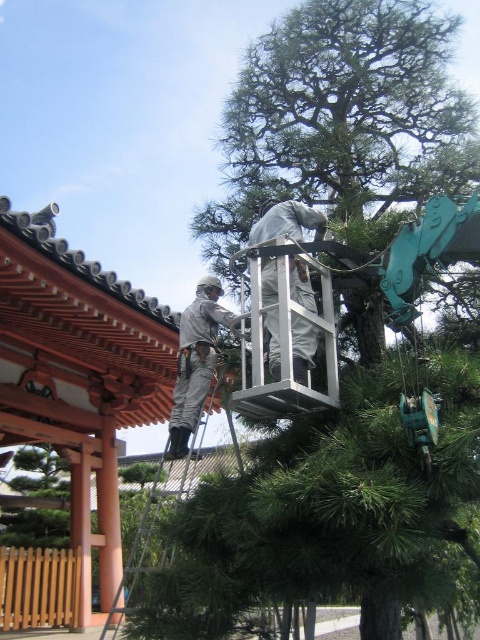
You are a safety inspector observing the tree maintenance scene. You notice two gray fabric items at the center of the image. The first is labeled as gray fabric at center and the second as gray fabric worker at center. According to safety protocols, which of these items should be the larger one to ensure proper visibility and safety?

The gray fabric worker at center should be the larger one because safety protocols require workers to wear high visibility gear, and the description states that the gray fabric at center is smaller than the gray fabric worker at center.

You are a maintenance worker in the park and need to reach the top of the large pine tree. There is a point marked at coordinates (171, 502). What object is located at this point?

The point at coordinates (171, 502) corresponds to the metallic silver ladder at center, which can be used to reach the top of the large pine tree.

You are a worker in the park and need to place a new sign between the two points, point [476,120] and point [179,449]. Which point is closer to the camera so the sign can be more visible?

Point [179,449] is closer to the camera than point [476,120], so placing the sign there would make it more visible.